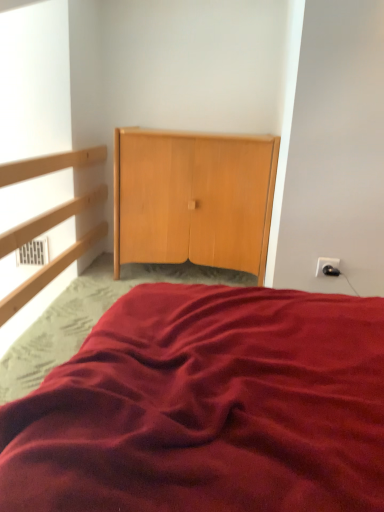
Question: Is black plastic outlet at upper right facing towards light wood dresser at center?

Choices:
 (A) no
 (B) yes

Answer: (A)

Question: Does black plastic outlet at upper right have a lesser width compared to light wood dresser at center?

Choices:
 (A) yes
 (B) no

Answer: (A)

Question: Is black plastic outlet at upper right wider than light wood dresser at center?

Choices:
 (A) no
 (B) yes

Answer: (A)

Question: Is black plastic outlet at upper right taller than light wood dresser at center?

Choices:
 (A) no
 (B) yes

Answer: (A)

Question: Considering the relative positions of black plastic outlet at upper right and light wood dresser at center in the image provided, is black plastic outlet at upper right to the left of light wood dresser at center from the viewer's perspective?

Choices:
 (A) yes
 (B) no

Answer: (B)

Question: Is the position of black plastic outlet at upper right less distant than that of light wood dresser at center?

Choices:
 (A) yes
 (B) no

Answer: (A)

Question: Does light wood dresser at center have a lesser height compared to burgundy satin bed at center?

Choices:
 (A) no
 (B) yes

Answer: (A)

Question: Is light wood dresser at center closer to the viewer compared to burgundy satin bed at center?

Choices:
 (A) yes
 (B) no

Answer: (B)

Question: From the image's perspective, is light wood dresser at center above burgundy satin bed at center?

Choices:
 (A) no
 (B) yes

Answer: (B)

Question: Can you confirm if light wood dresser at center is thinner than burgundy satin bed at center?

Choices:
 (A) yes
 (B) no

Answer: (A)

Question: Is light wood dresser at center facing away from burgundy satin bed at center?

Choices:
 (A) yes
 (B) no

Answer: (B)

Question: Considering the relative sizes of light wood dresser at center and burgundy satin bed at center in the image provided, is light wood dresser at center taller than burgundy satin bed at center?

Choices:
 (A) no
 (B) yes

Answer: (B)

Question: Is light wood dresser at center closer to the viewer compared to black plastic outlet at upper right?

Choices:
 (A) yes
 (B) no

Answer: (B)